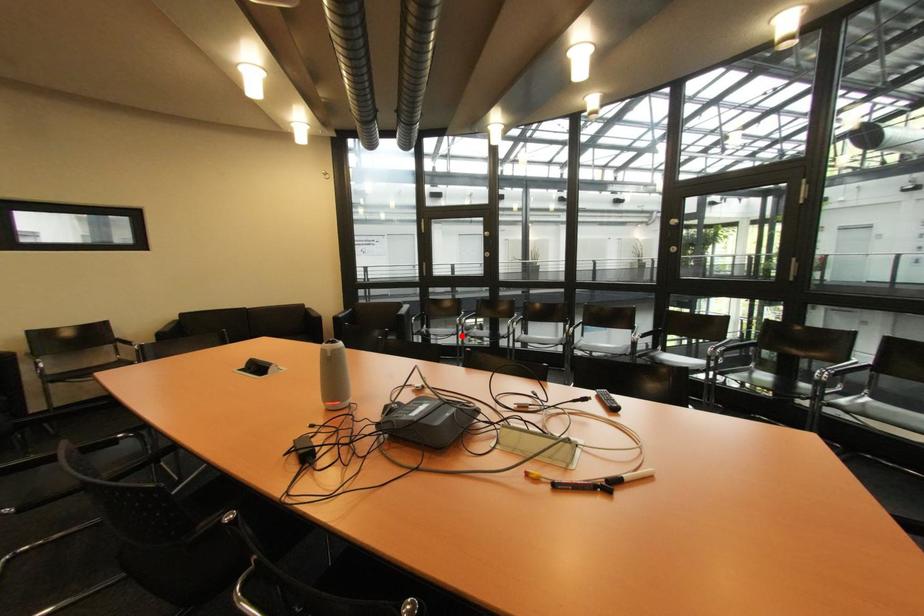
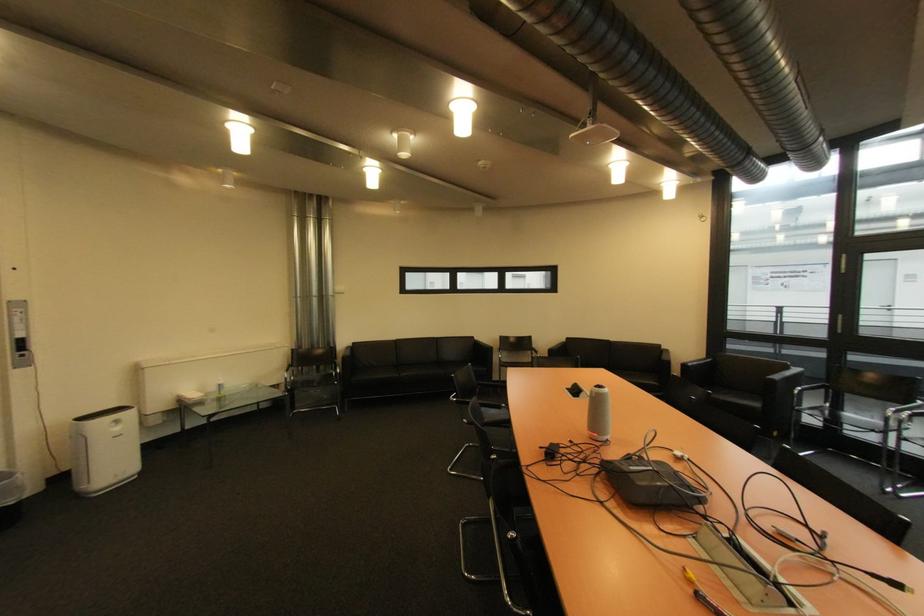
Where in the second image is the point corresponding to the highlighted location from the first image?

(882, 432)